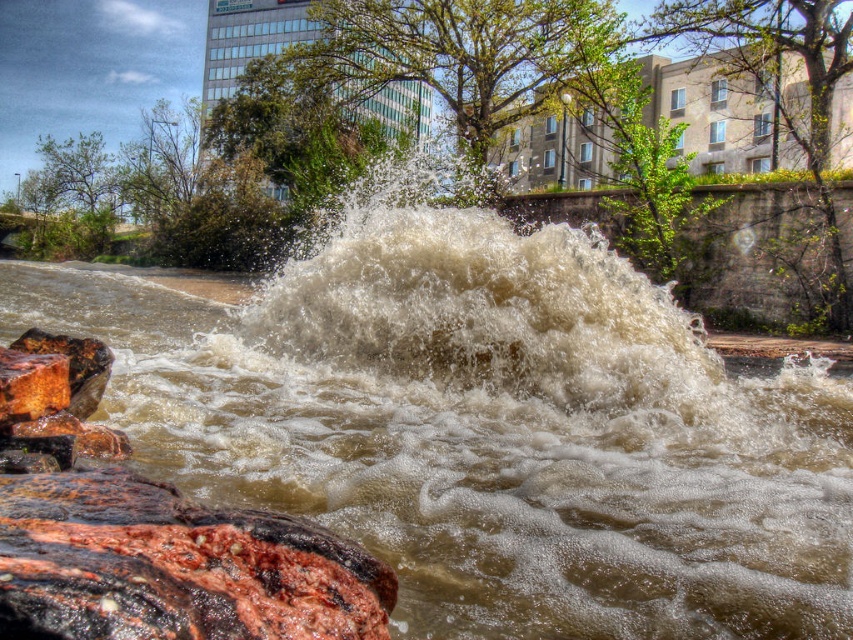
You are standing at the point closer to the camera between point [190,413] and point [469,449] in the image of the flooding river. Which point are you at?

You are at point [190,413] because it is further to the camera than point [469,449].

You are a photographer trying to capture the contrast between the brown foamy water at center and the frothy white water at center in the image. Which one is located to the left of the other?

The brown foamy water at center is positioned on the left side of frothy white water at center.